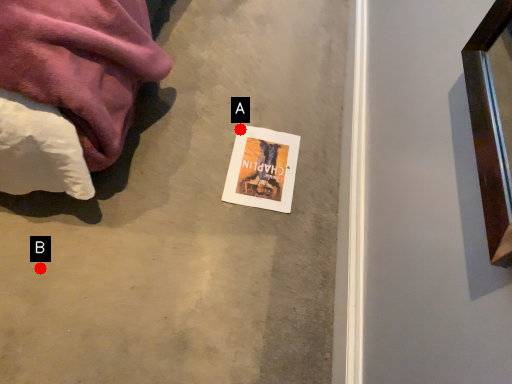
Question: Two points are circled on the image, labeled by A and B beside each circle. Which of the following is the farthest from the observer?

Choices:
 (A) A is further
 (B) B is further

Answer: (A)